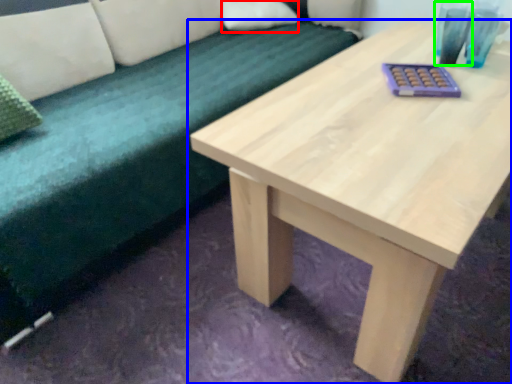
Question: Which object is the farthest from pillow (highlighted by a red box)? Choose among these: table (highlighted by a blue box) or glass vase (highlighted by a green box).

Choices:
 (A) table
 (B) glass vase

Answer: (A)